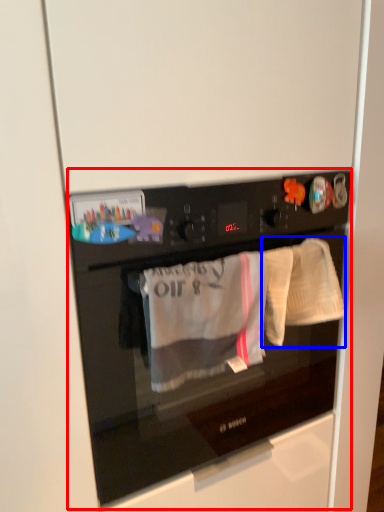
Question: Among these objects, which one is nearest to the camera, home appliance (highlighted by a red box) or baby clothe (highlighted by a blue box)?

Choices:
 (A) home appliance
 (B) baby clothe

Answer: (A)